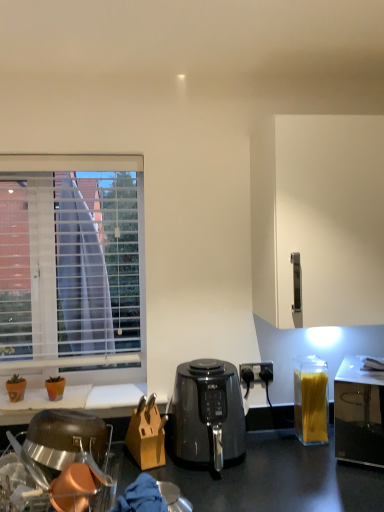
Describe the element at coordinates (318, 218) in the screenshot. This screenshot has height=512, width=384. I see `white matte cabinet at right` at that location.

Locate an element on the screen. This screenshot has height=512, width=384. white matte cabinet at right is located at coordinates (318, 218).

This screenshot has width=384, height=512. Describe the element at coordinates (207, 413) in the screenshot. I see `black plastic air fryer at center` at that location.

Locate an element on the screen. This screenshot has width=384, height=512. white matte desk at lower left is located at coordinates (73, 401).

This screenshot has height=512, width=384. Describe the element at coordinates (147, 434) in the screenshot. I see `wooden knife block at center` at that location.

The height and width of the screenshot is (512, 384). Identify the location of transparent plastic container of spaghetti at right. (359, 413).

Where is `white matte cabinet at right`? white matte cabinet at right is located at coordinates (318, 218).

Is white blinds at left looking in the opposite direction of white matte cabinet at right?

No, white blinds at left is not facing the opposite direction of white matte cabinet at right.

Which of these two, white blinds at left or white matte cabinet at right, is thinner?

white blinds at left is thinner.

Which is more to the left, white blinds at left or white matte cabinet at right?

white blinds at left is more to the left.

Which of these two, transparent plastic container of spaghetti at right or wooden knife block at center, is thinner?

Thinner between the two is wooden knife block at center.

Which is more to the left, transparent plastic container of spaghetti at right or wooden knife block at center?

wooden knife block at center is more to the left.

Is transparent plastic container of spaghetti at right next to wooden knife block at center?

No, transparent plastic container of spaghetti at right is not next to wooden knife block at center.

Does transparent plastic container of spaghetti at right contain wooden knife block at center?

No, wooden knife block at center is not inside transparent plastic container of spaghetti at right.

Is white matte cabinet at right in front of or behind white matte desk at lower left in the image?

Clearly, white matte cabinet at right is in front of white matte desk at lower left.

Does point (318, 306) come farther from viewer compared to point (47, 399)?

That is False.

Considering the sizes of objects white matte cabinet at right and white matte desk at lower left in the image provided, who is wider, white matte cabinet at right or white matte desk at lower left?

white matte cabinet at right.

This screenshot has height=512, width=384. I want to click on cardboard box located underneath the translucent plastic container of spaghetti at right (from a real-world perspective), so click(x=147, y=434).

Which of these two, translucent plastic container of spaghetti at right or wooden knife block at center, is bigger?

wooden knife block at center is bigger.

Looking at this image, which object is positioned more to the left, translucent plastic container of spaghetti at right or wooden knife block at center?

wooden knife block at center is more to the left.

From a real-world perspective, relative to wooden knife block at center, is translucent plastic container of spaghetti at right vertically above or below?

translucent plastic container of spaghetti at right is situated higher than wooden knife block at center in the real world.

Is wooden knife block at center inside or outside of transparent plastic container of spaghetti at right?

wooden knife block at center is located beyond the bounds of transparent plastic container of spaghetti at right.

Which object is closer to the camera, wooden knife block at center or transparent plastic container of spaghetti at right?

Positioned in front is transparent plastic container of spaghetti at right.

Is wooden knife block at center aimed at transparent plastic container of spaghetti at right?

No, wooden knife block at center does not turn towards transparent plastic container of spaghetti at right.

Looking at this image, from a real-world perspective, who is located lower, wooden knife block at center or transparent plastic container of spaghetti at right?

wooden knife block at center is physically lower.

Which is more to the right, wooden knife block at center or white matte desk at lower left?

Positioned to the right is wooden knife block at center.

Is wooden knife block at center smaller than white matte desk at lower left?

Yes, wooden knife block at center is smaller than white matte desk at lower left.

From a real-world perspective, who is located higher, wooden knife block at center or white matte desk at lower left?

white matte desk at lower left.

Is the surface of wooden knife block at center in direct contact with white matte desk at lower left?

No.

Is black plastic air fryer at center looking in the opposite direction of stainless steel dish rack at lower left?

No, stainless steel dish rack at lower left is not at the back of black plastic air fryer at center.

Which of these two, black plastic air fryer at center or stainless steel dish rack at lower left, is wider?

Wider between the two is stainless steel dish rack at lower left.

Can you confirm if black plastic air fryer at center is bigger than stainless steel dish rack at lower left?

Actually, black plastic air fryer at center might be smaller than stainless steel dish rack at lower left.

From a real-world perspective, relative to stainless steel dish rack at lower left, is black plastic air fryer at center vertically above or below?

From a real-world perspective, black plastic air fryer at center is physically above stainless steel dish rack at lower left.

You are a GUI agent. You are given a task and a screenshot of the screen. Output one action in this format:
    pyautogui.click(x=<x>, y=<y>)
    Task: Click on the window that is below the white matte cabinet at right (from the image's perspective)
    The height and width of the screenshot is (512, 384).
    Given the screenshot: What is the action you would take?
    pyautogui.click(x=72, y=268)

Image resolution: width=384 pixels, height=512 pixels. I want to click on cardboard box directly beneath the transparent plastic container of spaghetti at right (from a real-world perspective), so click(x=147, y=434).

Considering their positions, is wooden knife block at center positioned closer to stainless steel dish rack at lower left than white blinds at left?

wooden knife block at center is positioned closer to the anchor stainless steel dish rack at lower left.

Which object lies further to the anchor point white matte desk at lower left, wooden knife block at center or black plastic air fryer at center?

The object further to white matte desk at lower left is black plastic air fryer at center.

When comparing their distances from black plastic air fryer at center, does white matte desk at lower left or wooden knife block at center seem further?

Based on the image, white matte desk at lower left appears to be further to black plastic air fryer at center.

Considering their positions, is white matte cabinet at right positioned closer to white blinds at left than stainless steel dish rack at lower left?

Based on the image, stainless steel dish rack at lower left appears to be nearer to white blinds at left.

Which object lies nearer to the anchor point white matte desk at lower left, black plastic air fryer at center or wooden knife block at center?

wooden knife block at center lies closer to white matte desk at lower left than the other object.

Looking at this image, from the image, which object appears to be farther from translucent plastic container of spaghetti at right, stainless steel dish rack at lower left or transparent plastic container of spaghetti at right?

Based on the image, stainless steel dish rack at lower left appears to be further to translucent plastic container of spaghetti at right.

Based on their spatial positions, is black plastic air fryer at center or white matte cabinet at right closer to white blinds at left?

black plastic air fryer at center.

Considering their positions, is translucent plastic container of spaghetti at right positioned further to white matte desk at lower left than transparent plastic container of spaghetti at right?

Based on the image, transparent plastic container of spaghetti at right appears to be further to white matte desk at lower left.

The image size is (384, 512). What are the coordinates of `coffee maker between wooden knife block at center and translucent plastic container of spaghetti at right from left to right` in the screenshot? It's located at (207, 413).

You are a GUI agent. You are given a task and a screenshot of the screen. Output one action in this format:
    pyautogui.click(x=<x>, y=<y>)
    Task: Click on the toaster between white matte cabinet at right and black plastic air fryer at center in the vertical direction
    The image size is (384, 512).
    Given the screenshot: What is the action you would take?
    pyautogui.click(x=359, y=413)

You are a GUI agent. You are given a task and a screenshot of the screen. Output one action in this format:
    pyautogui.click(x=<x>, y=<y>)
    Task: Click on the desk between white blinds at left and wooden knife block at center from top to bottom
    This screenshot has width=384, height=512.
    Given the screenshot: What is the action you would take?
    pyautogui.click(x=73, y=401)

Identify the location of coffee maker between white blinds at left and white matte cabinet at right in the horizontal direction. This screenshot has height=512, width=384. (207, 413).